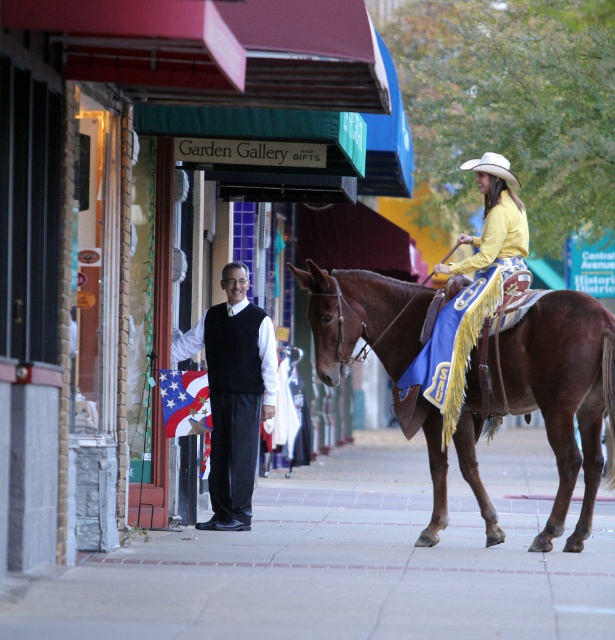
You are a delivery person trying to deliver a package to the Garden Gallery and Gifts store. You need to place the package between the brown leather horse at center and the white felt cowboy hat at upper center. Can you fit the package there?

The brown leather horse at center might be wider than white felt cowboy hat at upper center, so there might not be enough space to fit the package between them.

You are a fashion designer analyzing the scene. You see the black matte vest at center and the white felt cowboy hat at upper center. Which item is positioned higher in the image?

The white felt cowboy hat at upper center is positioned higher in the image than the black matte vest at center.